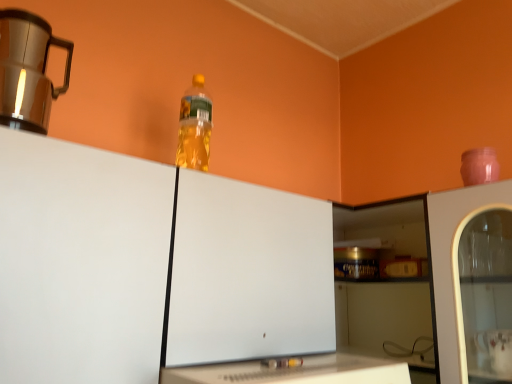
Question: Is transparent plastic bottle at upper center inside the boundaries of brushed metal mug at upper left, or outside?

Choices:
 (A) inside
 (B) outside

Answer: (B)

Question: From a real-world perspective, is transparent plastic bottle at upper center positioned above or below brushed metal mug at upper left?

Choices:
 (A) above
 (B) below

Answer: (B)

Question: Which object is the closest to the white glossy table at lower center?

Choices:
 (A) translucent plastic bottle at upper center
 (B) brushed metal mug at upper left
 (C) transparent plastic bottle at upper center

Answer: (C)

Question: Which of these objects is positioned farthest from the transparent plastic bottle at upper center?

Choices:
 (A) brushed metal mug at upper left
 (B) white glossy table at lower center
 (C) translucent plastic bottle at upper center

Answer: (A)